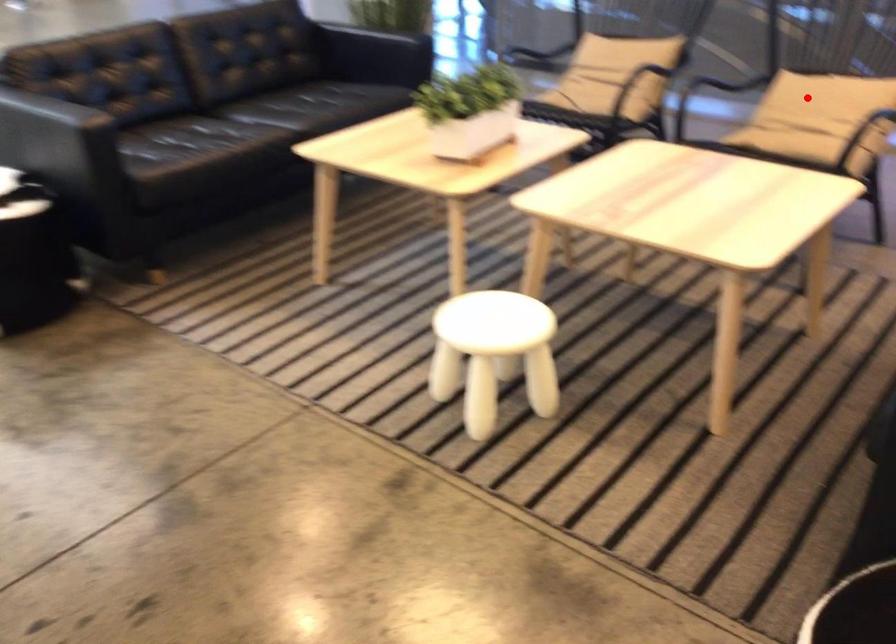
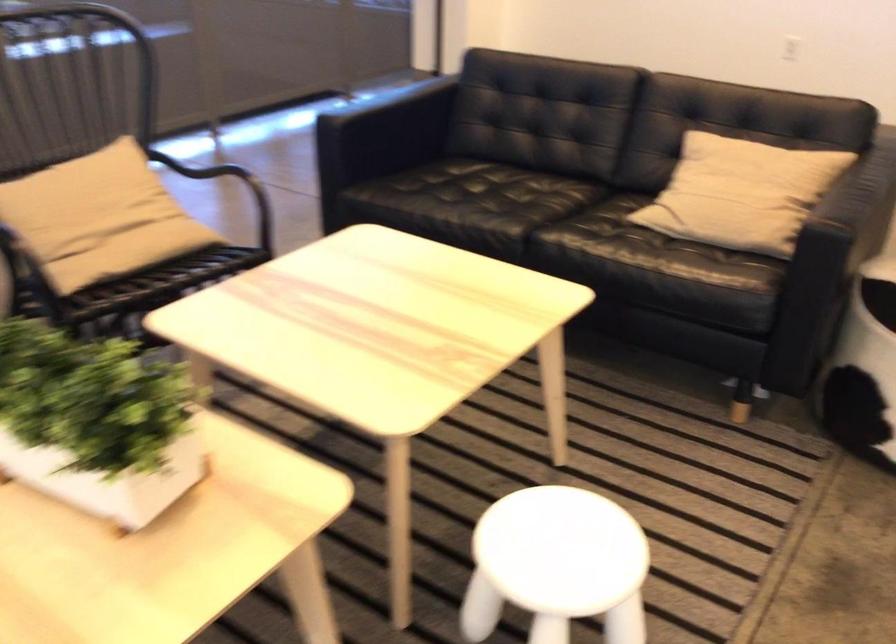
Question: I am providing you with two images of the same scene from different viewpoints. A red point is marked on the first image. Can you still see the location of the red point in image 2?

Choices:
 (A) Yes
 (B) No

Answer: (A)